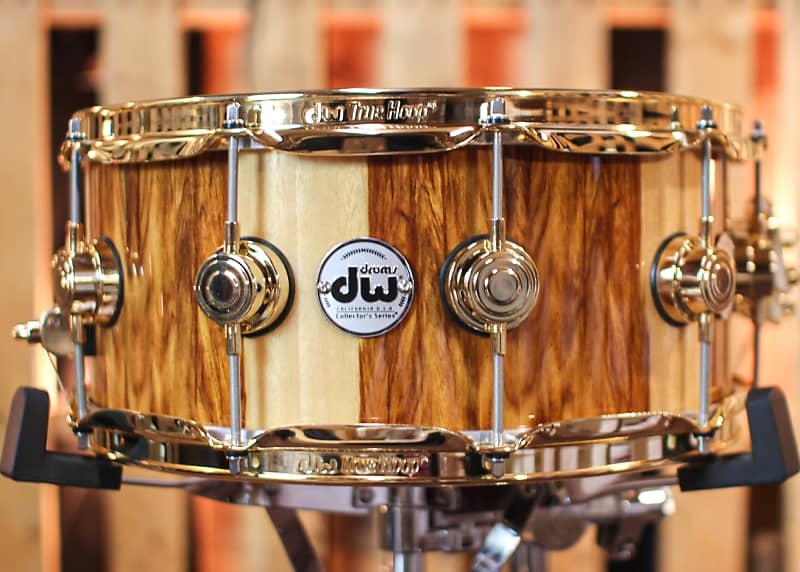
The image size is (800, 572). Identify the location of support bars. (290, 529), (502, 532), (597, 495), (232, 490).